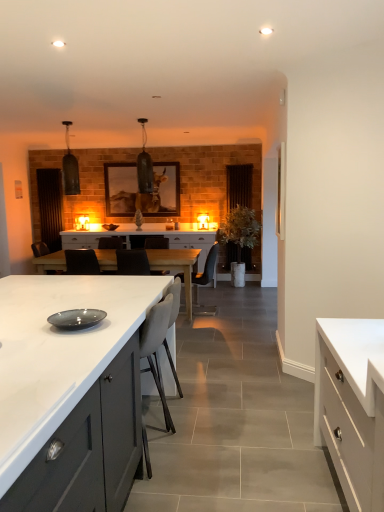
Find the location of a particular element. This screenshot has width=384, height=512. free location in front of matte gray plate at center is located at coordinates (69, 342).